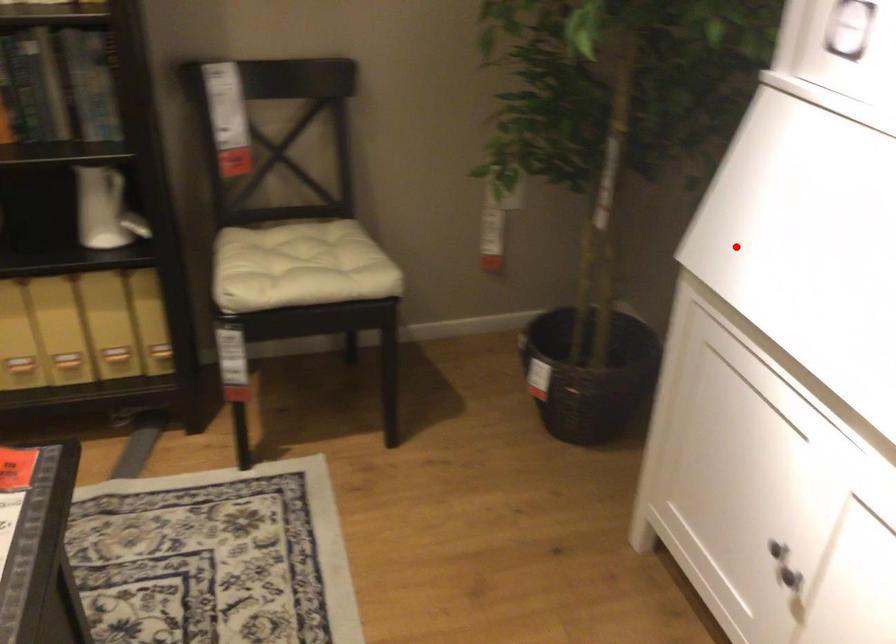
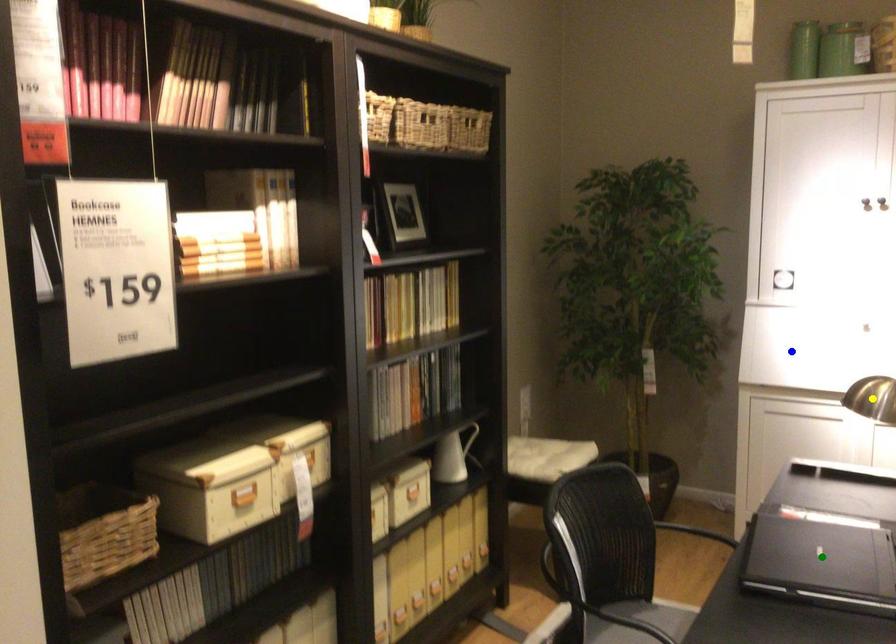
Question: I am providing you with two images of the same scene from different viewpoints. A red point is marked on the first image. You are given multiple points on the second image. Which mark in image 2 goes with the point in image 1?

Choices:
 (A) yellow point
 (B) blue point
 (C) green point

Answer: (B)